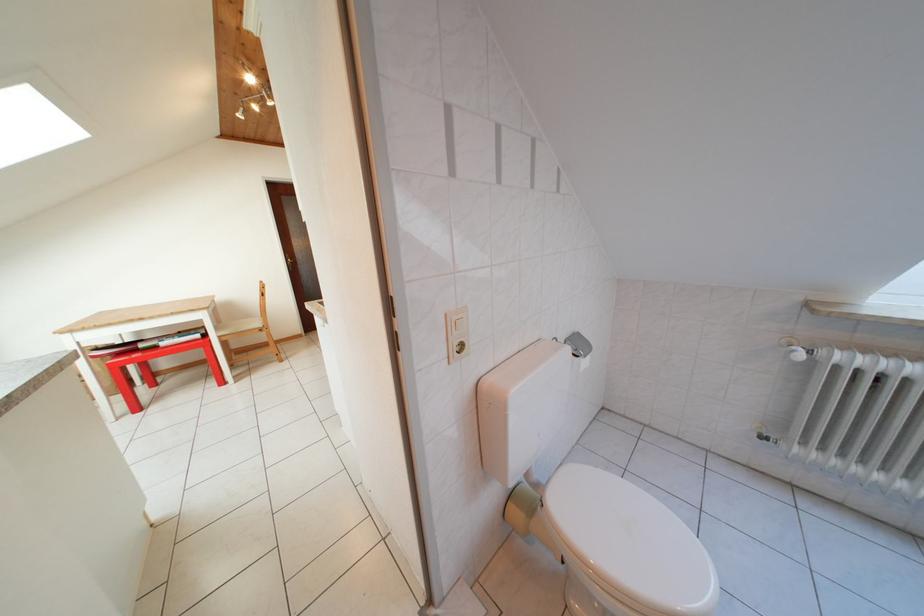
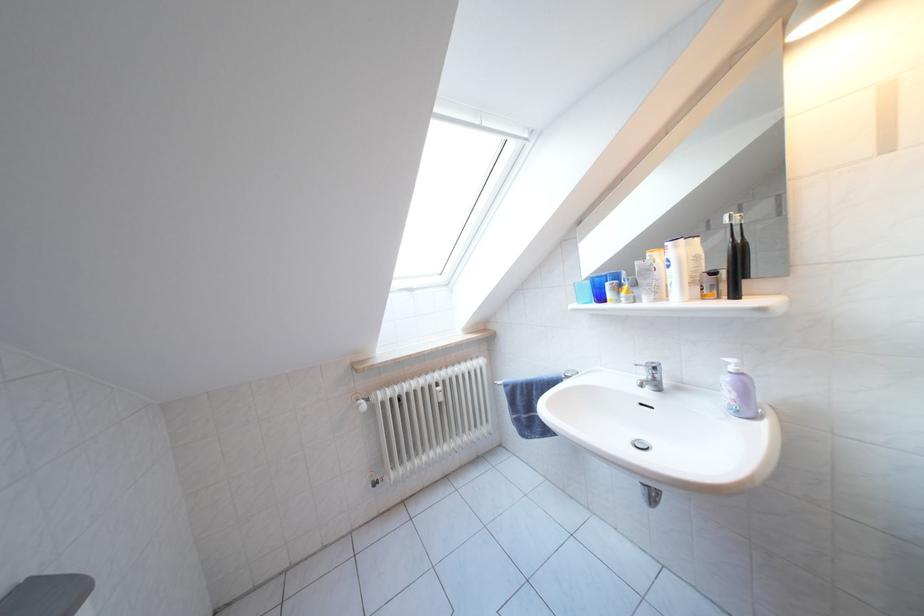
Question: The camera is either moving clockwise (left) or counter-clockwise (right) around the object. The first image is from the beginning of the video and the second image is from the end. Is the camera moving left or right when shooting the video?

Choices:
 (A) Left
 (B) Right

Answer: (A)